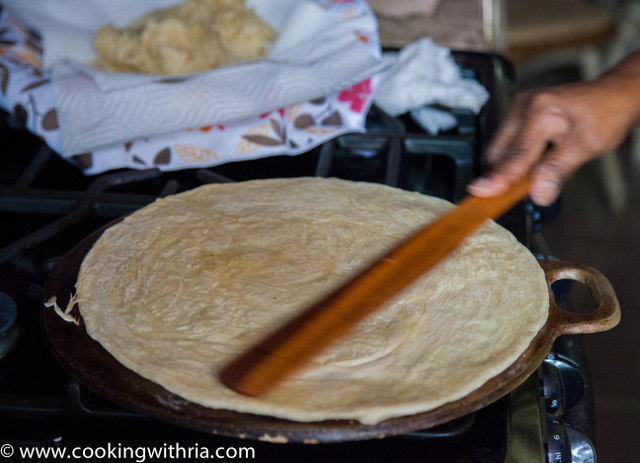
Where is `wooden utensil`? wooden utensil is located at coordinates (248, 365), (287, 340), (323, 315), (372, 275), (397, 261), (445, 236).